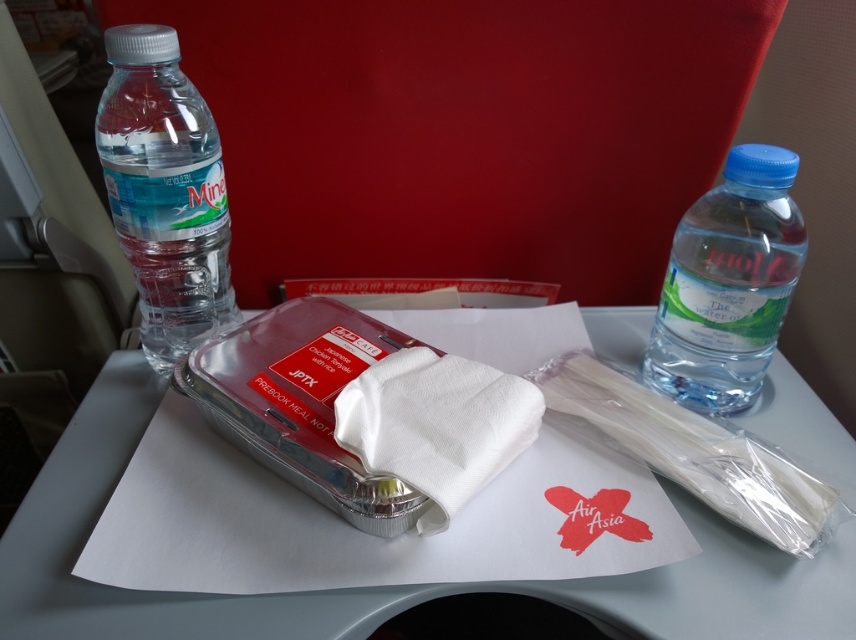
Based on the photo, can you confirm if white paper napkin at center is thinner than white paper towel at center?

In fact, white paper napkin at center might be wider than white paper towel at center.

Between point (661, 586) and point (349, 387), which one is positioned behind?

The point (349, 387) is more distant.

What do you see at coordinates (379, 588) in the screenshot?
I see `white paper napkin at center` at bounding box center [379, 588].

The width and height of the screenshot is (856, 640). In order to click on white paper napkin at center in this screenshot , I will do `click(379, 588)`.

Does transparent plastic bottle at left have a greater height compared to white paper towel at center?

Yes, transparent plastic bottle at left is taller than white paper towel at center.

Does transparent plastic bottle at left lie behind white paper towel at center?

Yes, transparent plastic bottle at left is behind white paper towel at center.

At what (x,y) coordinates should I click in order to perform the action: click on transparent plastic bottle at left. Please return your answer as a coordinate pair (x, y). This screenshot has width=856, height=640. Looking at the image, I should click on (164, 189).

Can you confirm if white paper napkin at center is bigger than clear plastic bottle at right?

Indeed, white paper napkin at center has a larger size compared to clear plastic bottle at right.

Which is in front, point (764, 625) or point (724, 289)?

Point (764, 625)

Where is `white paper napkin at center`? white paper napkin at center is located at coordinates (379, 588).